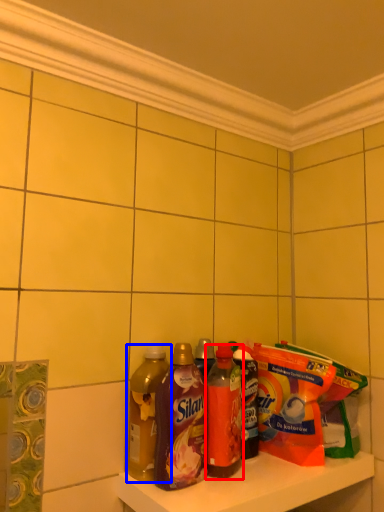
Question: Among these objects, which one is nearest to the camera, bottle (highlighted by a red box) or bottle (highlighted by a blue box)?

Choices:
 (A) bottle
 (B) bottle

Answer: (B)